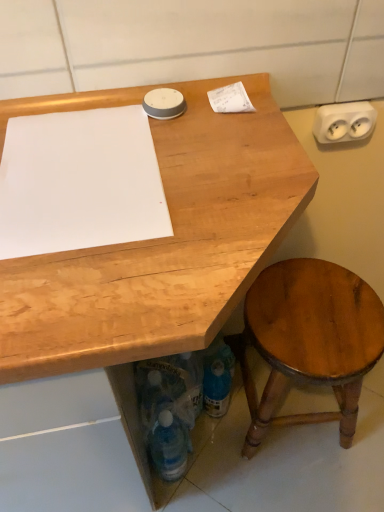
You are a GUI agent. You are given a task and a screenshot of the screen. Output one action in this format:
    pyautogui.click(x=<x>, y=<y>)
    Task: Click on the free spot above white paper at upper left, which is the second notepad from right to left (from a real-world perspective)
    This screenshot has width=384, height=512.
    Given the screenshot: What is the action you would take?
    pyautogui.click(x=81, y=166)